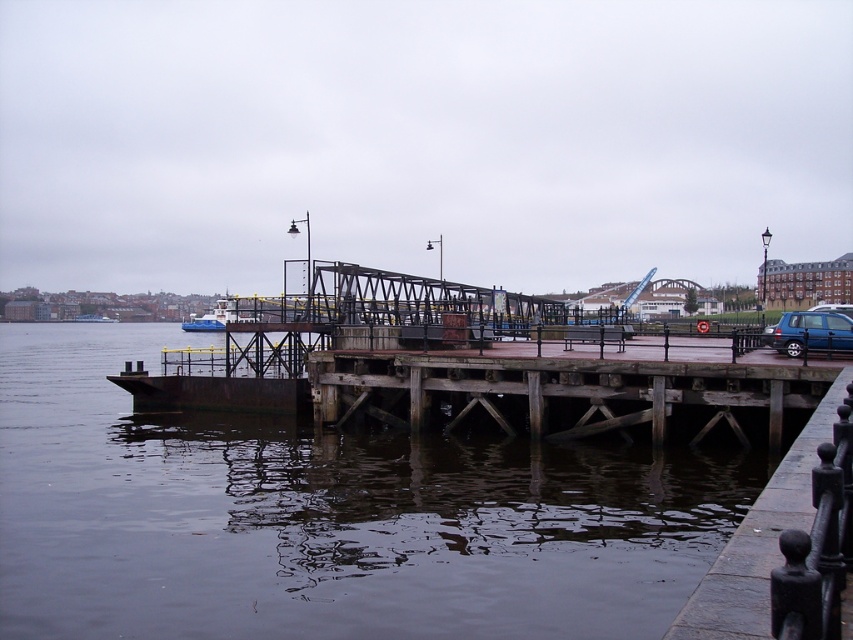
Question: Among these objects, which one is farthest from the camera?

Choices:
 (A) blue metallic van at right
 (B) rusty metal bridge at center
 (C) blue matte boat at left

Answer: (C)

Question: Which of the following is the closest to the observer?

Choices:
 (A) (207, 316)
 (B) (804, 326)

Answer: (B)

Question: Considering the relative positions of dark gray water at lower left and blue metallic van at right in the image provided, where is dark gray water at lower left located with respect to blue metallic van at right?

Choices:
 (A) below
 (B) above

Answer: (A)

Question: Which point is farther from the camera taking this photo?

Choices:
 (A) (244, 316)
 (B) (378, 388)
 (C) (704, 552)
 (D) (776, 349)

Answer: (A)

Question: Does rusty metal bridge at center have a greater width compared to blue metallic van at right?

Choices:
 (A) yes
 (B) no

Answer: (A)

Question: Can you confirm if rusty metal bridge at center is positioned above blue metallic van at right?

Choices:
 (A) no
 (B) yes

Answer: (A)